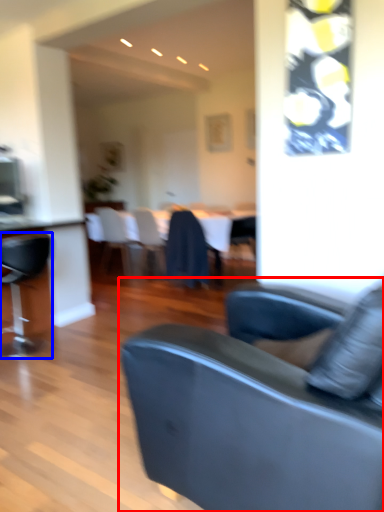
Question: Among these objects, which one is farthest to the camera, studio couch (highlighted by a red box) or chair (highlighted by a blue box)?

Choices:
 (A) studio couch
 (B) chair

Answer: (B)